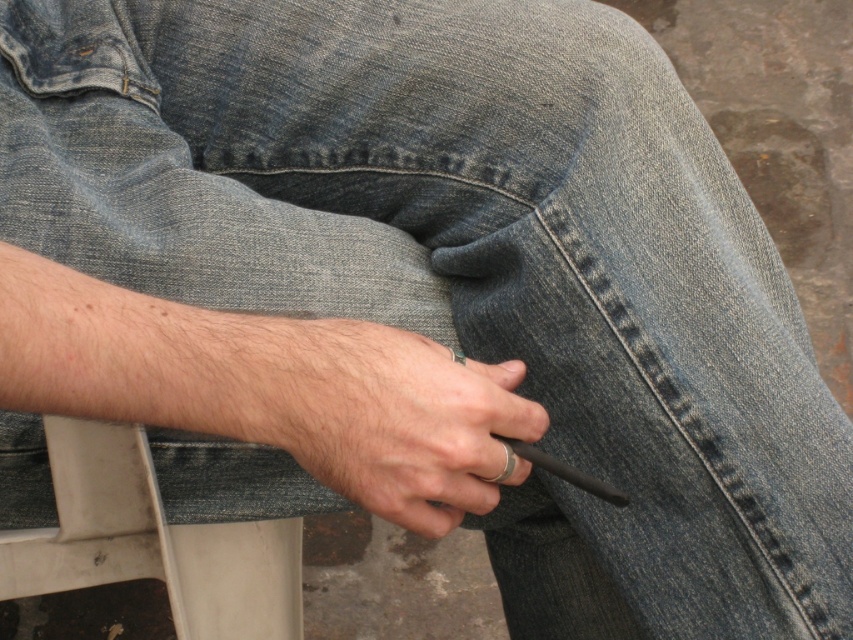
Question: Is matte black pen at center bigger than white plastic chair at lower left?

Choices:
 (A) no
 (B) yes

Answer: (A)

Question: Which of the following is the farthest from the observer?

Choices:
 (A) (534, 461)
 (B) (132, 429)

Answer: (B)

Question: Which object appears farthest from the camera in this image?

Choices:
 (A) matte black pen at center
 (B) black matte cigarette at center
 (C) white plastic chair at lower left

Answer: (C)

Question: In this image, where is matte black pen at center located relative to black matte cigarette at center?

Choices:
 (A) above
 (B) below

Answer: (A)

Question: Is matte black pen at center behind white plastic chair at lower left?

Choices:
 (A) no
 (B) yes

Answer: (A)

Question: Based on their relative distances, which object is farther from the black matte cigarette at center?

Choices:
 (A) white plastic chair at lower left
 (B) matte black pen at center

Answer: (A)